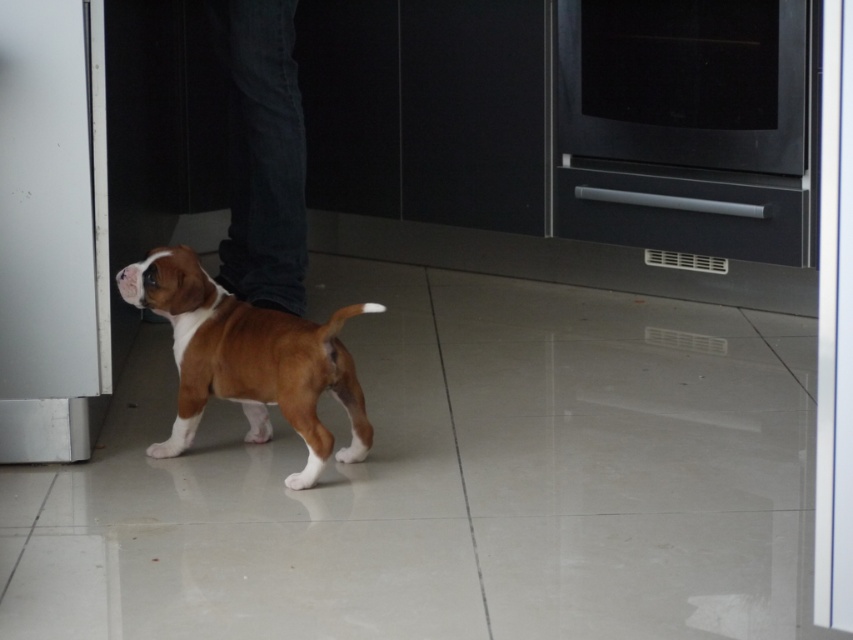
You are a delivery person who needs to place a new microwave that is 1.2 meters wide into the kitchen. You see the black matte oven at upper right and the brown matte dog at center. Which object has enough space to accommodate the microwave?

The black matte oven at upper right has a larger width than the brown matte dog at center, so the microwave can be placed near the black matte oven at upper right since it has sufficient space.

You are a delivery robot in a house. You need to place a package on the floor near the black matte oven at upper right. The coordinates of the oven are given as point (683, 125). Can you confirm if this point is on the oven?

Yes, the point (683, 125) is on the black matte oven at upper right, so the package can be placed there.

You are a delivery robot trying to pass through the kitchen area where the brown matte dog at center and the dark blue jeans at center are located. The robot is 0.5 meters wide. Can the robot navigate between the dog and the jeans without squeezing?

The brown matte dog at center is wider than the dark blue jeans at center. Since the dog is wider, the space between them may be narrower than the robot requires. However, the exact distance isn not provided, so it is uncertain if the robot can pass without squeezing.